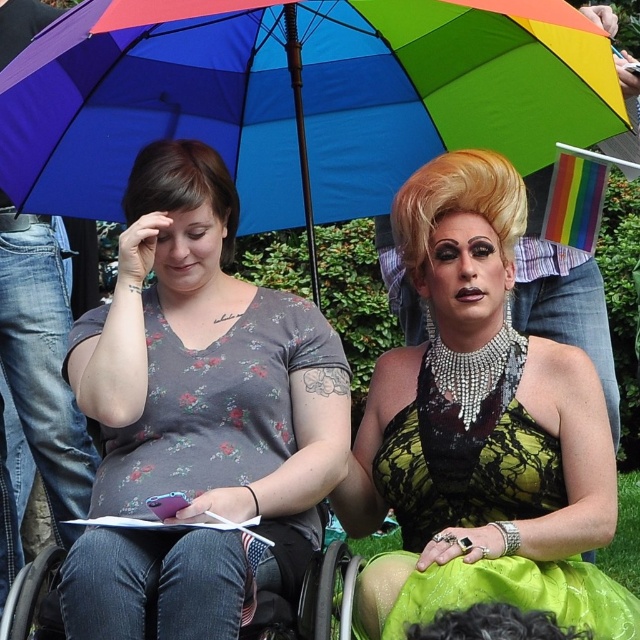
You are a photographer setting up for a group photo. You need to ensure that all subjects are visible. Given the floral printed shirt at center and the black plastic wheelchair at lower center, which object should you focus on to capture both in the frame without cropping?

The floral printed shirt at center is bigger than the black plastic wheelchair at lower center, so focusing on the floral printed shirt at center would ensure both are visible in the frame.

You are an artist trying to sketch the scene from the image. To ensure accuracy, you need to know the exact position of the rainbow fabric umbrella at upper center. What are the coordinates of its location?

The rainbow fabric umbrella at upper center is located at coordinates point (294, 97).

You are a photographer trying to capture a group photo of the two people under the rainbow umbrella. You want to ensure both the floral printed shirt at center and the green satin dress at center are clearly visible. Given their sizes, which clothing item should you focus on first to avoid blurring due to movement?

The floral printed shirt at center is narrower than the green satin dress at center, so focusing on the green satin dress at center first would be better as it is larger and might require more precise framing to avoid blurring.